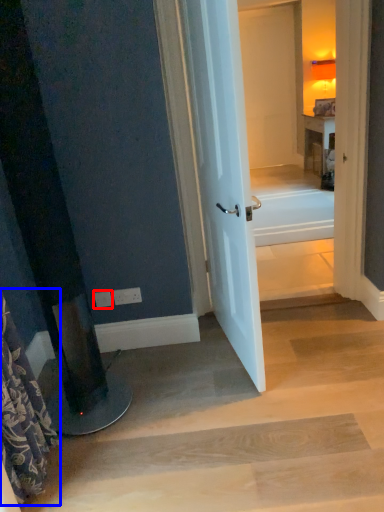
Question: Which point is closer to the camera, electric outlet (highlighted by a red box) or shower curtain (highlighted by a blue box)?

Choices:
 (A) electric outlet
 (B) shower curtain

Answer: (B)